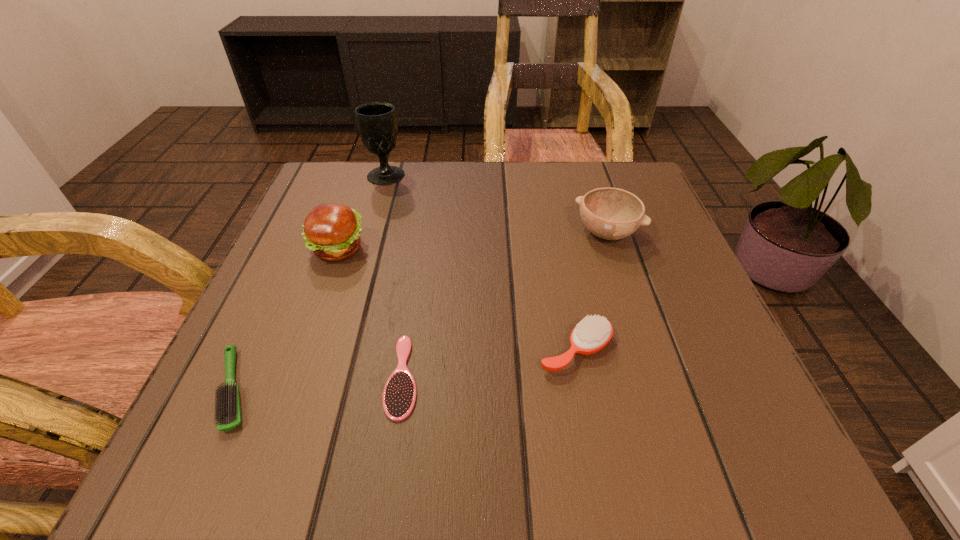
At what (x,y) coordinates should I click in order to perform the action: click on free space that is in between the third object from right to left and the leftmost hairbrush. Please return your answer as a coordinate pair (x, y). This screenshot has width=960, height=540. Looking at the image, I should click on (318, 383).

At what (x,y) coordinates should I click in order to perform the action: click on vacant point located between the fourth shortest object and the tallest hairbrush. Please return your answer as a coordinate pair (x, y). This screenshot has width=960, height=540. Looking at the image, I should click on (591, 292).

Find the location of a particular element. This screenshot has height=540, width=960. the fifth closest object to the fifth tallest object is located at coordinates (610, 213).

Identify which object is located as the nearest to the third tallest object. Please provide its 2D coordinates. Your answer should be formatted as a tuple, i.e. [(x, y)], where the tuple contains the x and y coordinates of a point satisfying the conditions above.

[(593, 333)]

This screenshot has width=960, height=540. I want to click on hairbrush object that ranks as the closest to the leftmost hairbrush, so click(x=399, y=396).

Identify the location of hairbrush that stands as the third closest to the tallest object. (593, 333).

Find the location of a particular element. Image resolution: width=960 pixels, height=540 pixels. free space that satisfies the following two spatial constraints: 1. on the back side of the shortest object; 2. on the left side of the third shortest object is located at coordinates (407, 350).

Identify the location of free location that satisfies the following two spatial constraints: 1. on the back side of the bowl; 2. on the left side of the tallest hairbrush. This screenshot has height=540, width=960. (553, 234).

Locate an element on the screen. free spot that satisfies the following two spatial constraints: 1. on the back side of the second shortest hairbrush; 2. on the right side of the hamburger is located at coordinates (298, 249).